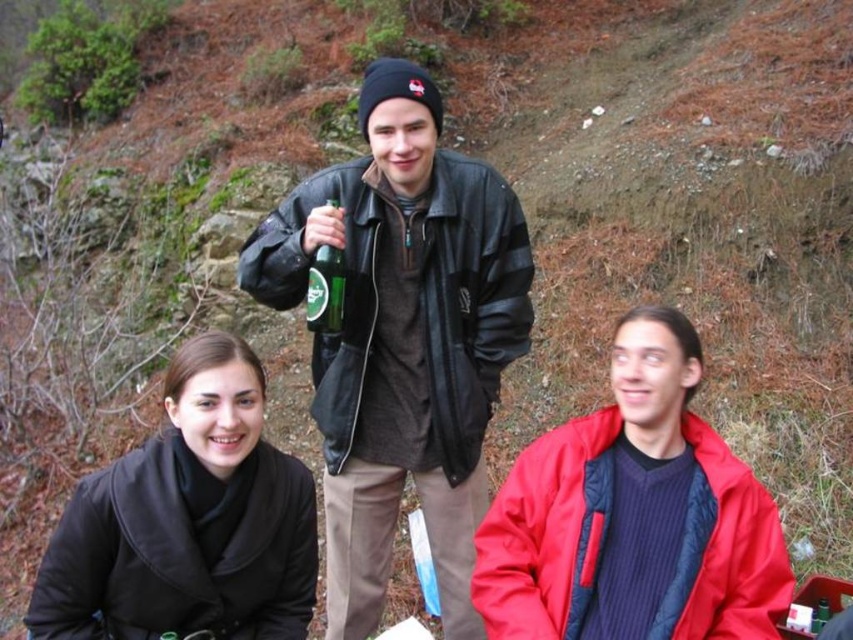
You are a photographer trying to capture the leather jacket at center in the image. What are the coordinates where you should focus your camera?

The leather jacket at center is located at coordinates point (402, 339).

You are a photographer trying to capture a group photo of the people in the scene. You want to ensure that both the red matte jacket at center and the black matte coat at lower left are clearly visible in the frame. Considering their sizes, which object should you focus on to ensure it doesn not get cropped out?

The black matte coat at lower left is taller than the red matte jacket at center, so you should focus on ensuring the black matte coat at lower left is fully in frame to avoid cropping.